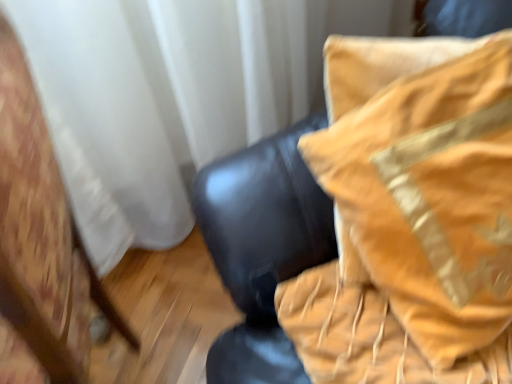
The height and width of the screenshot is (384, 512). What do you see at coordinates (37, 237) in the screenshot?
I see `wooden chair at left, placed as the 1th furniture when sorted from left to right` at bounding box center [37, 237].

How much space does wooden chair at left, placed as the 1th furniture when sorted from left to right, occupy horizontally?

It is 16.85 inches.

The image size is (512, 384). Identify the location of wooden chair at left, which is the 2th furniture in right-to-left order. (37, 237).

You are a GUI agent. You are given a task and a screenshot of the screen. Output one action in this format:
    pyautogui.click(x=<x>, y=<y>)
    Task: Click on the velvet gold pillow at upper right, the first furniture from the right
    This screenshot has height=384, width=512.
    Given the screenshot: What is the action you would take?
    point(254,357)

What do you see at coordinates (254, 357) in the screenshot? I see `velvet gold pillow at upper right, the first furniture from the right` at bounding box center [254, 357].

Image resolution: width=512 pixels, height=384 pixels. Identify the location of wooden chair at left, which is the 2th furniture in right-to-left order. (37, 237).

Considering the positions of objects wooden chair at left, which is the 2th furniture in right-to-left order, and velvet gold pillow at upper right, the first furniture from the right, in the image provided, who is more to the left, wooden chair at left, which is the 2th furniture in right-to-left order, or velvet gold pillow at upper right, the first furniture from the right,?

Positioned to the left is wooden chair at left, which is the 2th furniture in right-to-left order.

Does wooden chair at left, which is the 2th furniture in right-to-left order, come in front of velvet gold pillow at upper right, the first furniture from the right?

Yes, wooden chair at left, which is the 2th furniture in right-to-left order, is closer to the camera.

Which is closer to the camera, [42,344] or [466,13]?

Point [42,344] is closer to the camera than point [466,13].

From the image's perspective, who appears lower, wooden chair at left, which is the 2th furniture in right-to-left order, or velvet gold pillow at upper right, the 2th furniture when ordered from left to right?

wooden chair at left, which is the 2th furniture in right-to-left order, appears lower in the image.

From a real-world perspective, which object stands above the other?

From a 3D spatial view, velvet gold pillow at upper right, the 2th furniture when ordered from left to right, is above.

Which of these two, wooden chair at left, which is the 2th furniture in right-to-left order, or velvet gold pillow at upper right, the 2th furniture when ordered from left to right, is wider?

Wider between the two is wooden chair at left, which is the 2th furniture in right-to-left order.

Considering the sizes of wooden chair at left, which is the 2th furniture in right-to-left order, and velvet gold pillow at upper right, the first furniture from the right, in the image, is wooden chair at left, which is the 2th furniture in right-to-left order, taller or shorter than velvet gold pillow at upper right, the first furniture from the right,?

wooden chair at left, which is the 2th furniture in right-to-left order, is taller than velvet gold pillow at upper right, the first furniture from the right.

Considering the relative sizes of wooden chair at left, which is the 2th furniture in right-to-left order, and velvet gold pillow at upper right, the 2th furniture when ordered from left to right, in the image provided, is wooden chair at left, which is the 2th furniture in right-to-left order, smaller than velvet gold pillow at upper right, the 2th furniture when ordered from left to right,?

No.

Is wooden chair at left, placed as the 1th furniture when sorted from left to right, situated inside velvet gold pillow at upper right, the first furniture from the right, or outside?

wooden chair at left, placed as the 1th furniture when sorted from left to right, is located beyond the bounds of velvet gold pillow at upper right, the first furniture from the right.

Are wooden chair at left, placed as the 1th furniture when sorted from left to right, and velvet gold pillow at upper right, the first furniture from the right, far apart?

No, wooden chair at left, placed as the 1th furniture when sorted from left to right, is not far from velvet gold pillow at upper right, the first furniture from the right.

Could you tell me if wooden chair at left, which is the 2th furniture in right-to-left order, is facing velvet gold pillow at upper right, the 2th furniture when ordered from left to right?

No.

How distant is wooden chair at left, which is the 2th furniture in right-to-left order, from velvet gold pillow at upper right, the first furniture from the right?

The distance of wooden chair at left, which is the 2th furniture in right-to-left order, from velvet gold pillow at upper right, the first furniture from the right, is 10.68 inches.

This screenshot has width=512, height=384. I want to click on furniture below the velvet gold pillow at upper right, the first furniture from the right (from a real-world perspective), so click(37, 237).

Can you confirm if velvet gold pillow at upper right, the 2th furniture when ordered from left to right, is positioned to the right of wooden chair at left, placed as the 1th furniture when sorted from left to right?

Yes, velvet gold pillow at upper right, the 2th furniture when ordered from left to right, is to the right of wooden chair at left, placed as the 1th furniture when sorted from left to right.

Does velvet gold pillow at upper right, the first furniture from the right, come behind wooden chair at left, which is the 2th furniture in right-to-left order?

Yes.

Which is in front, point (224, 269) or point (51, 284)?

The point (51, 284) is closer to the camera.

From the image's perspective, who appears lower, velvet gold pillow at upper right, the first furniture from the right, or wooden chair at left, which is the 2th furniture in right-to-left order?

wooden chair at left, which is the 2th furniture in right-to-left order, is shown below in the image.

From a real-world perspective, between velvet gold pillow at upper right, the 2th furniture when ordered from left to right, and wooden chair at left, which is the 2th furniture in right-to-left order, who is vertically higher?

velvet gold pillow at upper right, the 2th furniture when ordered from left to right, is physically above.

Which object is wider, velvet gold pillow at upper right, the 2th furniture when ordered from left to right, or wooden chair at left, which is the 2th furniture in right-to-left order?

wooden chair at left, which is the 2th furniture in right-to-left order, is wider.

Looking at this image, considering the sizes of objects velvet gold pillow at upper right, the 2th furniture when ordered from left to right, and wooden chair at left, which is the 2th furniture in right-to-left order, in the image provided, who is shorter, velvet gold pillow at upper right, the 2th furniture when ordered from left to right, or wooden chair at left, which is the 2th furniture in right-to-left order,?

Standing shorter between the two is velvet gold pillow at upper right, the 2th furniture when ordered from left to right.

Based on the photo, between velvet gold pillow at upper right, the first furniture from the right, and wooden chair at left, which is the 2th furniture in right-to-left order, which one has smaller size?

Smaller between the two is velvet gold pillow at upper right, the first furniture from the right.

Is velvet gold pillow at upper right, the first furniture from the right, outside of wooden chair at left, placed as the 1th furniture when sorted from left to right?

Yes, velvet gold pillow at upper right, the first furniture from the right, is located beyond the bounds of wooden chair at left, placed as the 1th furniture when sorted from left to right.

Would you consider velvet gold pillow at upper right, the 2th furniture when ordered from left to right, to be distant from wooden chair at left, which is the 2th furniture in right-to-left order?

They are positioned close to each other.

Is wooden chair at left, placed as the 1th furniture when sorted from left to right, at the back of velvet gold pillow at upper right, the first furniture from the right?

No, velvet gold pillow at upper right, the first furniture from the right, is not facing the opposite direction of wooden chair at left, placed as the 1th furniture when sorted from left to right.

How many degrees apart are the facing directions of velvet gold pillow at upper right, the first furniture from the right, and wooden chair at left, placed as the 1th furniture when sorted from left to right?

69.2 degrees separate the facing orientations of velvet gold pillow at upper right, the first furniture from the right, and wooden chair at left, placed as the 1th furniture when sorted from left to right.

How distant is velvet gold pillow at upper right, the 2th furniture when ordered from left to right, from wooden chair at left, which is the 2th furniture in right-to-left order?

The distance of velvet gold pillow at upper right, the 2th furniture when ordered from left to right, from wooden chair at left, which is the 2th furniture in right-to-left order, is 10.68 inches.

Locate an element on the screen. furniture on the right side of wooden chair at left, placed as the 1th furniture when sorted from left to right is located at coordinates coord(254,357).

The width and height of the screenshot is (512, 384). In order to click on furniture on the left of velvet gold pillow at upper right, the 2th furniture when ordered from left to right in this screenshot , I will do `click(37, 237)`.

Image resolution: width=512 pixels, height=384 pixels. In the image, there is a wooden chair at left, placed as the 1th furniture when sorted from left to right. In order to click on furniture above it (from the image's perspective) in this screenshot , I will do `click(254, 357)`.